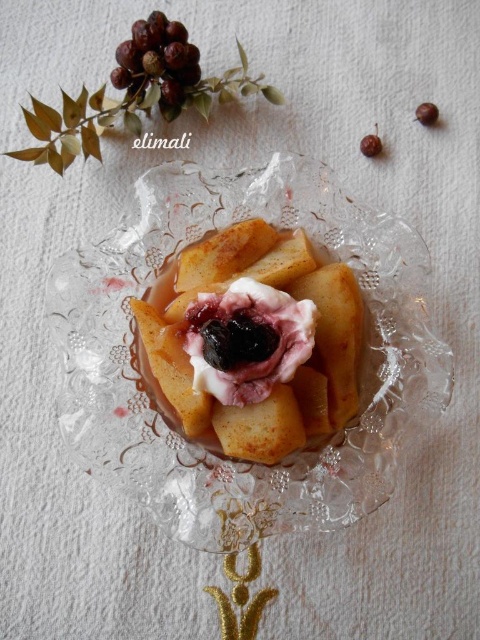
You are a food stylist arranging a dessert display. You have a clear glass platter at center and a slightly browned crumbly cake at center. According to the scene, which object is positioned to the left of the other?

The clear glass platter at center is to the left of the slightly browned crumbly cake at center.

You are a food stylist arranging this dessert. You notice two points on the plate where you want to place garnishes. The first point is at coordinates point (264, 308), and the second is at point (369, 134). Which garnish placement point is closer to the viewer?

Point (264, 308) is in front of point (369, 134), so the garnish placed at point (264, 308) will be closer to the viewer.

You are a food stylist arranging a dessert display. You have a clear glass platter at center and a brown matte berry at upper right. According to the image, which object is located to the right of the other?

The clear glass platter at center is positioned on the left side of brown matte berry at upper right, so the brown matte berry at upper right is to the right of the clear glass platter at center.